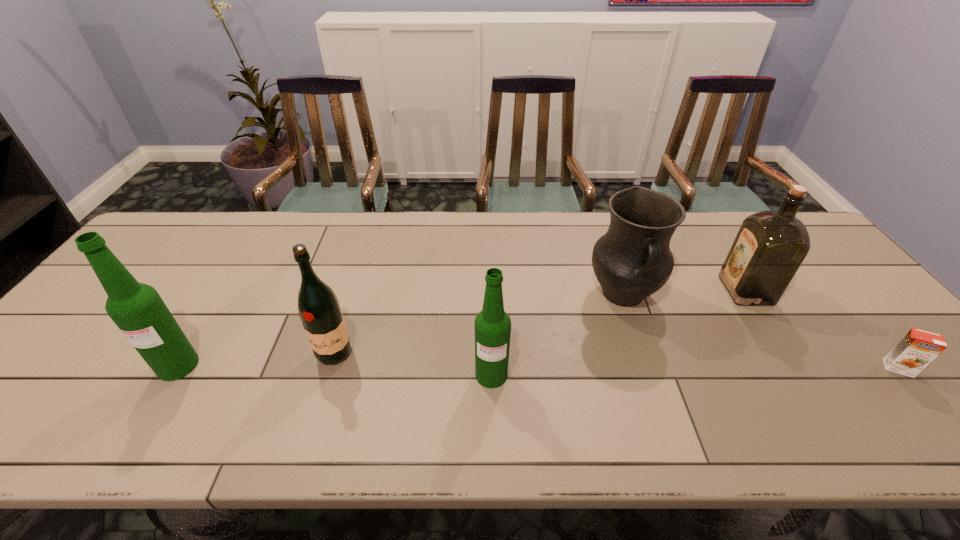
Image resolution: width=960 pixels, height=540 pixels. Find the location of `blank region between the taller beer bottle and the right beer bottle`. blank region between the taller beer bottle and the right beer bottle is located at coordinates (335, 370).

I want to click on empty space between the fourth object from left to right and the right liquor, so click(684, 293).

Locate an element on the screen. The image size is (960, 540). vacant point located between the shortest object and the taller beer bottle is located at coordinates [x=539, y=367].

You are a GUI agent. You are given a task and a screenshot of the screen. Output one action in this format:
    pyautogui.click(x=<x>, y=<y>)
    Task: Click on the vacant space in between the third object from right to left and the left beer bottle
    Image resolution: width=960 pixels, height=540 pixels.
    Given the screenshot: What is the action you would take?
    pyautogui.click(x=400, y=330)

Identify which object is the second closest to the fourth object from left to right. Please provide its 2D coordinates. Your answer should be formatted as a tuple, i.e. [(x, y)], where the tuple contains the x and y coordinates of a point satisfying the conditions above.

[(492, 325)]

Select which object is the second closest to the right liquor. Please provide its 2D coordinates. Your answer should be formatted as a tuple, i.e. [(x, y)], where the tuple contains the x and y coordinates of a point satisfying the conditions above.

[(917, 349)]

You are a GUI agent. You are given a task and a screenshot of the screen. Output one action in this format:
    pyautogui.click(x=<x>, y=<y>)
    Task: Click on the vacant area that satisfies the following two spatial constraints: 1. on the label of the right liquor; 2. on the label of the taller beer bottle
    
    Given the screenshot: What is the action you would take?
    pyautogui.click(x=794, y=366)

What are the coordinates of `vacant space that satisfies the following two spatial constraints: 1. on the label of the orange juice; 2. on the left side of the leftmost object` in the screenshot? It's located at (177, 368).